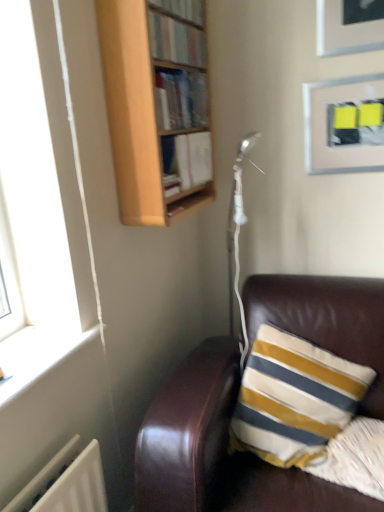
Locate an element on the screen. The height and width of the screenshot is (512, 384). brown leather couch at lower right is located at coordinates (217, 449).

Describe the element at coordinates (186, 160) in the screenshot. I see `hardcover book at upper center, the third book when ordered from top to bottom` at that location.

Measure the distance between point (x=123, y=96) and camera.

Point (x=123, y=96) is 1.28 meters away from camera.

This screenshot has width=384, height=512. What do you see at coordinates (176, 41) in the screenshot?
I see `wooden bookshelf at upper center, the first book positioned from the top` at bounding box center [176, 41].

Image resolution: width=384 pixels, height=512 pixels. Identify the location of wooden bookshelf at upper center, which appears as the 2th book when viewed from the top. (181, 99).

From a real-world perspective, is brown leather couch at lower right beneath wooden bookcase at upper center?

Yes.

Is brown leather couch at lower right looking in the opposite direction of wooden bookcase at upper center?

brown leather couch at lower right is not turned away from wooden bookcase at upper center.

Considering the positions of objects brown leather couch at lower right and wooden bookcase at upper center in the image provided, who is more to the right, brown leather couch at lower right or wooden bookcase at upper center?

Positioned to the right is brown leather couch at lower right.

Is brown leather couch at lower right surrounding wooden bookcase at upper center?

No, wooden bookcase at upper center is located outside of brown leather couch at lower right.

From a real-world perspective, is wooden bookshelf at upper center, which appears as the 2th book when viewed from the top, above or below metallic silver picture frame at upper right?

From a real-world perspective, wooden bookshelf at upper center, which appears as the 2th book when viewed from the top, is physically above metallic silver picture frame at upper right.

From the image's perspective, which is below, wooden bookshelf at upper center, which appears as the 2th book when viewed from the top, or metallic silver picture frame at upper right?

metallic silver picture frame at upper right, from the image's perspective.

Considering the positions of points (203, 82) and (330, 138), is point (203, 82) closer to camera compared to point (330, 138)?

Yes.

Considering the positions of objects wooden bookshelf at upper center, which appears as the 2th book when viewed from the top, and metallic silver picture frame at upper right in the image provided, who is in front, wooden bookshelf at upper center, which appears as the 2th book when viewed from the top, or metallic silver picture frame at upper right?

wooden bookshelf at upper center, which appears as the 2th book when viewed from the top, is more forward.

Considering the positions of points (175, 183) and (170, 116), is point (175, 183) closer to camera compared to point (170, 116)?

No, it is behind (170, 116).

Considering the sizes of objects hardcover book at upper center, the first book when ordered from bottom to top, and wooden bookshelf at upper center, the second book ordered from the bottom, in the image provided, who is shorter, hardcover book at upper center, the first book when ordered from bottom to top, or wooden bookshelf at upper center, the second book ordered from the bottom,?

With less height is wooden bookshelf at upper center, the second book ordered from the bottom.

Is the position of hardcover book at upper center, the first book when ordered from bottom to top, less distant than that of wooden bookshelf at upper center, the second book ordered from the bottom?

No.

From a real-world perspective, is brown leather couch at lower right positioned above or below wooden bookshelf at upper center, the second book ordered from the bottom?

From a real-world perspective, brown leather couch at lower right is physically below wooden bookshelf at upper center, the second book ordered from the bottom.

Is point (162, 471) more distant than point (181, 122)?

That is False.

Locate an element on the screen. The width and height of the screenshot is (384, 512). studio couch on the right of wooden bookshelf at upper center, which appears as the 2th book when viewed from the top is located at coordinates (217, 449).

Consider the image. Can we say brown leather couch at lower right lies outside wooden bookshelf at upper center, the second book ordered from the bottom?

brown leather couch at lower right lies outside wooden bookshelf at upper center, the second book ordered from the bottom,'s area.

Considering the sizes of objects wooden bookshelf at upper center, which appears as the 2th book when viewed from the top, and brown leather couch at lower right in the image provided, who is wider, wooden bookshelf at upper center, which appears as the 2th book when viewed from the top, or brown leather couch at lower right?

brown leather couch at lower right is wider.

Can you confirm if wooden bookshelf at upper center, which appears as the 2th book when viewed from the top, is smaller than brown leather couch at lower right?

Correct, wooden bookshelf at upper center, which appears as the 2th book when viewed from the top, occupies less space than brown leather couch at lower right.

Does wooden bookshelf at upper center, which appears as the 2th book when viewed from the top, turn towards brown leather couch at lower right?

No.

Is wooden bookcase at upper center inside or outside of wooden bookshelf at upper center, the first book positioned from the top?

The correct answer is: outside.

I want to click on the 1st book behind the wooden bookcase at upper center, starting your count from the anchor, so click(x=176, y=41).

Considering the relative sizes of wooden bookcase at upper center and wooden bookshelf at upper center, the third book positioned from the bottom, in the image provided, is wooden bookcase at upper center thinner than wooden bookshelf at upper center, the third book positioned from the bottom,?

In fact, wooden bookcase at upper center might be wider than wooden bookshelf at upper center, the third book positioned from the bottom.

From their relative heights in the image, would you say wooden bookcase at upper center is taller or shorter than wooden bookshelf at upper center, the first book positioned from the top?

Clearly, wooden bookcase at upper center is taller compared to wooden bookshelf at upper center, the first book positioned from the top.

The height and width of the screenshot is (512, 384). Find the location of `picture frame above the brown leather couch at lower right (from the image's perspective)`. picture frame above the brown leather couch at lower right (from the image's perspective) is located at coordinates (344, 125).

From the picture: Can you confirm if metallic silver picture frame at upper right is taller than brown leather couch at lower right?

In fact, metallic silver picture frame at upper right may be shorter than brown leather couch at lower right.

Which is in front, metallic silver picture frame at upper right or brown leather couch at lower right?

brown leather couch at lower right is in front.

Is metallic silver picture frame at upper right directly adjacent to brown leather couch at lower right?

No, metallic silver picture frame at upper right is not beside brown leather couch at lower right.

In the image, there is a wooden bookcase at upper center. Where is `studio couch below it (from the image's perspective)`? This screenshot has width=384, height=512. studio couch below it (from the image's perspective) is located at coordinates (217, 449).

At what (x,y) coordinates should I click in order to perform the action: click on picture frame lying behind the wooden bookshelf at upper center, which appears as the 2th book when viewed from the top. Please return your answer as a coordinate pair (x, y). Looking at the image, I should click on (344, 125).

When comparing their distances from brown leather couch at lower right, does striped fabric pillow at lower right or wooden bookcase at upper center seem closer?

Among the two, striped fabric pillow at lower right is located nearer to brown leather couch at lower right.

From the image, which object appears to be nearer to metallic silver picture frame at upper right, wooden bookshelf at upper center, the first book positioned from the top, or wooden bookshelf at upper center, which appears as the 2th book when viewed from the top?

The object closer to metallic silver picture frame at upper right is wooden bookshelf at upper center, which appears as the 2th book when viewed from the top.

From the image, which object appears to be farther from wooden bookcase at upper center, wooden bookshelf at upper center, the third book positioned from the bottom, or hardcover book at upper center, the third book when ordered from top to bottom?

The object further to wooden bookcase at upper center is wooden bookshelf at upper center, the third book positioned from the bottom.

From the image, which object appears to be farther from wooden bookshelf at upper center, the first book positioned from the top, metallic silver picture frame at upper right or striped fabric pillow at lower right?

striped fabric pillow at lower right is further to wooden bookshelf at upper center, the first book positioned from the top.

Based on their spatial positions, is striped fabric pillow at lower right or brown leather couch at lower right closer to metallic silver picture frame at upper right?

The object closer to metallic silver picture frame at upper right is brown leather couch at lower right.

Looking at the image, which one is located closer to striped fabric pillow at lower right, metallic silver picture frame at upper right or wooden bookshelf at upper center, the first book positioned from the top?

metallic silver picture frame at upper right lies closer to striped fabric pillow at lower right than the other object.

From the image, which object appears to be farther from metallic silver picture frame at upper right, hardcover book at upper center, the first book when ordered from bottom to top, or wooden bookshelf at upper center, which appears as the 2th book when viewed from the top?

Among the two, wooden bookshelf at upper center, which appears as the 2th book when viewed from the top, is located further to metallic silver picture frame at upper right.

In the scene shown: Estimate the real-world distances between objects in this image. Which object is further from wooden bookcase at upper center, wooden bookshelf at upper center, which appears as the 2th book when viewed from the top, or metallic silver picture frame at upper right?

metallic silver picture frame at upper right is further to wooden bookcase at upper center.

Where is `pillow between wooden bookshelf at upper center, the second book ordered from the bottom, and brown leather couch at lower right from top to bottom`? The height and width of the screenshot is (512, 384). pillow between wooden bookshelf at upper center, the second book ordered from the bottom, and brown leather couch at lower right from top to bottom is located at coordinates (355, 458).

Identify the location of pillow between wooden bookcase at upper center and brown leather couch at lower right vertically. (355, 458).

Locate an element on the screen. pillow between wooden bookshelf at upper center, the first book positioned from the top, and brown leather couch at lower right, in the vertical direction is located at coordinates (355, 458).

Where is `book between metallic silver picture frame at upper right and brown leather couch at lower right from top to bottom`? Image resolution: width=384 pixels, height=512 pixels. book between metallic silver picture frame at upper right and brown leather couch at lower right from top to bottom is located at coordinates (186, 160).